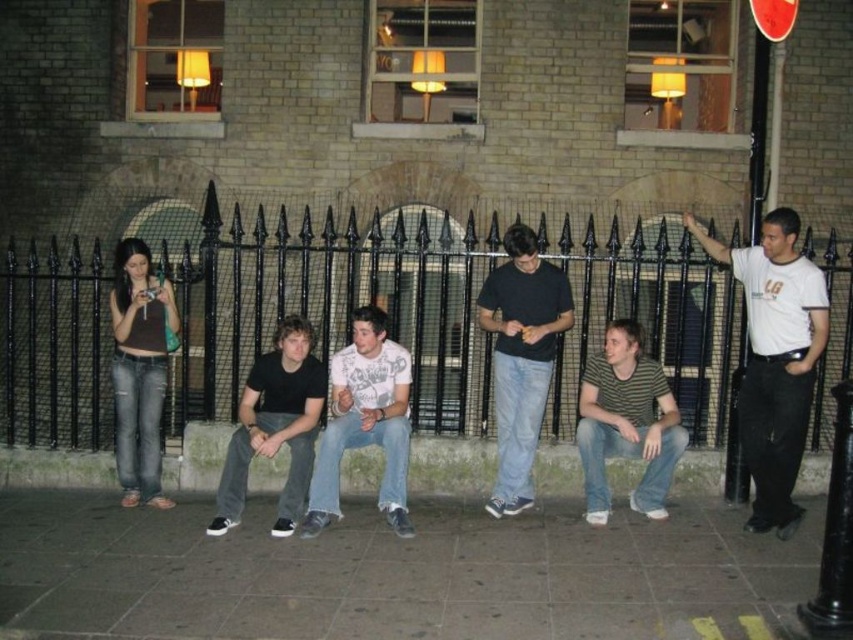
In the scene shown: You are a photographer trying to capture the scene with a wide angle lens. Since the gray concrete pavement at lower center and the striped cotton shirt at center are both in your frame, which one takes up more space in the photo?

The striped cotton shirt at center takes up more space in the photo because the gray concrete pavement at lower center occupies less space than striped cotton shirt at center.

You are standing on the gray concrete pavement at lower center and want to hand a document to the person wearing the striped cotton shirt at center. Can you reach them without moving from your current position?

The gray concrete pavement at lower center is in front of striped cotton shirt at center, so you can reach them without moving because you are already positioned in front of them.